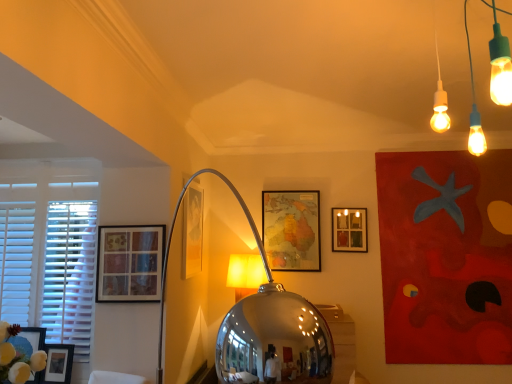
Question: From the image's perspective, does matte glass picture frame at center, marked as the 3th picture frame in a back-to-front arrangement, appear higher than matte glass picture frame at upper center, placed as the first picture frame when sorted from right to left?

Choices:
 (A) no
 (B) yes

Answer: (B)

Question: Can you confirm if matte glass picture frame at center, which ranks as the third picture frame in left-to-right order, is shorter than matte glass picture frame at upper center, the fifth picture frame in the left-to-right sequence?

Choices:
 (A) no
 (B) yes

Answer: (A)

Question: Is matte glass picture frame at center, which ranks as the third picture frame in front-to-back order, thinner than matte glass picture frame at upper center, the fifth picture frame in the left-to-right sequence?

Choices:
 (A) no
 (B) yes

Answer: (B)

Question: Is matte glass picture frame at center, arranged as the 3th picture frame when viewed from the right, at the left side of matte glass picture frame at upper center, which is the 4th picture frame in front-to-back order?

Choices:
 (A) yes
 (B) no

Answer: (A)

Question: Could you tell me if matte glass picture frame at center, arranged as the 3th picture frame when viewed from the right, is facing matte glass picture frame at upper center, the fifth picture frame in the left-to-right sequence?

Choices:
 (A) yes
 (B) no

Answer: (A)

Question: Relative to matte glass picture frame at upper center, which is the 4th picture frame in front-to-back order, is matte glass picture frame at center, which ranks as the third picture frame in front-to-back order, in front or behind?

Choices:
 (A) behind
 (B) front

Answer: (B)

Question: In terms of height, does matte glass picture frame at center, arranged as the 3th picture frame when viewed from the right, look taller or shorter compared to matte glass picture frame at upper center, the 2th picture frame positioned from the back?

Choices:
 (A) short
 (B) tall

Answer: (B)

Question: Considering the positions of matte glass picture frame at center, marked as the 3th picture frame in a back-to-front arrangement, and matte glass picture frame at upper center, placed as the first picture frame when sorted from right to left, in the image, is matte glass picture frame at center, marked as the 3th picture frame in a back-to-front arrangement, bigger or smaller than matte glass picture frame at upper center, placed as the first picture frame when sorted from right to left,?

Choices:
 (A) small
 (B) big

Answer: (B)

Question: Visually, is matte glass picture frame at center, arranged as the 3th picture frame when viewed from the right, positioned to the left or to the right of matte glass picture frame at upper center, which is the 4th picture frame in front-to-back order?

Choices:
 (A) left
 (B) right

Answer: (A)

Question: Visually, is white matte window at left positioned to the left or to the right of matte black picture frame at lower left, marked as the 2th picture frame in a front-to-back arrangement?

Choices:
 (A) left
 (B) right

Answer: (A)

Question: In terms of size, does white matte window at left appear bigger or smaller than matte black picture frame at lower left, which is the fifth picture frame from right to left?

Choices:
 (A) small
 (B) big

Answer: (B)

Question: Considering the positions of point (x=58, y=178) and point (x=58, y=375), is point (x=58, y=178) closer or farther from the camera than point (x=58, y=375)?

Choices:
 (A) closer
 (B) farther

Answer: (B)

Question: In terms of height, does white matte window at left look taller or shorter compared to matte black picture frame at lower left, which is the fifth picture frame from right to left?

Choices:
 (A) short
 (B) tall

Answer: (B)

Question: Is matte black picture frame at lower left, which is the fifth picture frame from right to left, in front of or behind matte glass picture frame at upper center, placed as the first picture frame when sorted from right to left, in the image?

Choices:
 (A) front
 (B) behind

Answer: (A)

Question: In terms of height, does matte black picture frame at lower left, which is the fifth picture frame from right to left, look taller or shorter compared to matte glass picture frame at upper center, which is the 4th picture frame in front-to-back order?

Choices:
 (A) tall
 (B) short

Answer: (B)